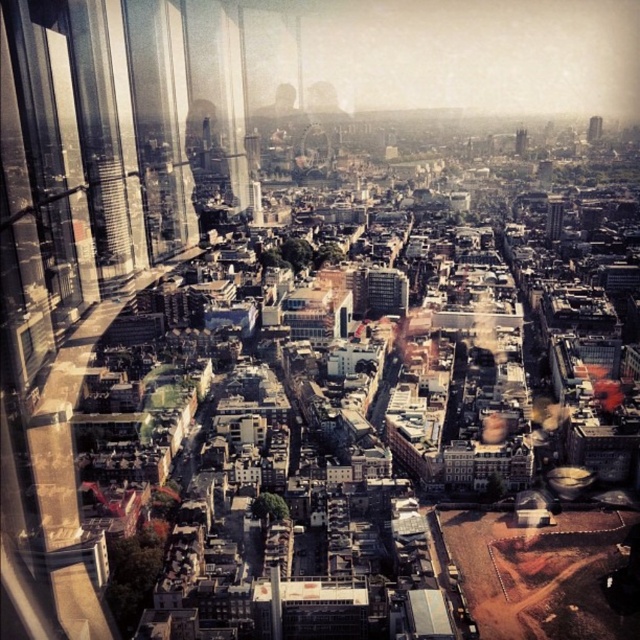
Question: Does smooth glass tower at upper right lie behind dark brown stone tower at center?

Choices:
 (A) yes
 (B) no

Answer: (A)

Question: Can you confirm if smooth glass tower at center is positioned to the right of smooth glass tower at upper right?

Choices:
 (A) no
 (B) yes

Answer: (A)

Question: Which point is closer to the camera taking this photo?

Choices:
 (A) (598, 120)
 (B) (524, 132)

Answer: (B)

Question: Can you confirm if smooth glass tower at center is bigger than dark brown stone tower at center?

Choices:
 (A) yes
 (B) no

Answer: (A)

Question: Estimate the real-world distances between objects in this image. Which object is closer to the dark brown stone tower at center?

Choices:
 (A) smooth glass tower at center
 (B) smooth glass tower at upper right

Answer: (B)

Question: Estimate the real-world distances between objects in this image. Which object is closer to the smooth glass tower at center?

Choices:
 (A) dark brown stone tower at center
 (B) smooth glass tower at upper right

Answer: (A)